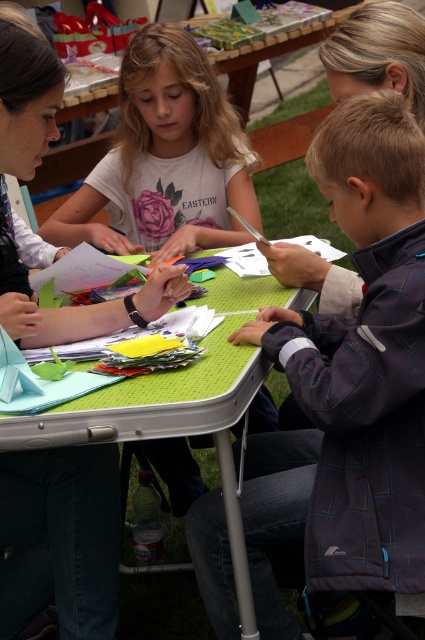
You are a child at the event and want to reach the water bottle located near the bottom left corner of the green textured table at center. However, the dark blue textured jacket at lower right is in your way. Can you move around it to access the table?

The green textured table at center is behind the dark blue textured jacket at lower right, so you can move around the jacket to access the table and reach the water bottle.

You are a photographer at the event and want to take a photo of the dark blue textured jacket at lower right and the matte white shirt at upper center. Which object is closer to the camera?

The dark blue textured jacket at lower right is in front of the matte white shirt at upper center, so it is closer to the camera.

You are a photographer trying to capture a wide shot of the crafting activity. The matte white shirt at upper center and the green textured table at center are both in the frame. Based on their sizes, which object would appear larger in the photo?

The matte white shirt at upper center might appear larger in the photo than the green textured table at center because it could be wider.